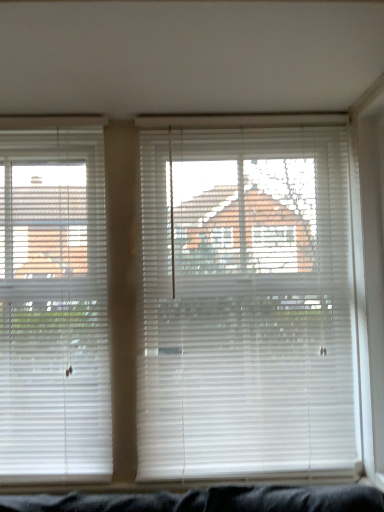
Question: From a real-world perspective, is white plastic blinds at left, positioned as the 1th window blind in left-to-right order, over white plastic blinds at center, the 2th window blind when ordered from left to right?

Choices:
 (A) no
 (B) yes

Answer: (B)

Question: Can you confirm if white plastic blinds at left, marked as the 2th window blind in a right-to-left arrangement, is thinner than white plastic blinds at center, the 2th window blind when ordered from left to right?

Choices:
 (A) no
 (B) yes

Answer: (B)

Question: Is white plastic blinds at left, positioned as the 1th window blind in left-to-right order, completely or partially outside of white plastic blinds at center, the 2th window blind when ordered from left to right?

Choices:
 (A) no
 (B) yes

Answer: (B)

Question: Can you confirm if white plastic blinds at left, marked as the 2th window blind in a right-to-left arrangement, is bigger than white plastic blinds at center, the first window blind from the right?

Choices:
 (A) no
 (B) yes

Answer: (A)

Question: Is white plastic blinds at left, positioned as the 1th window blind in left-to-right order, closer to camera compared to white plastic blinds at center, the first window blind from the right?

Choices:
 (A) no
 (B) yes

Answer: (A)

Question: Can you confirm if white plastic blinds at left, positioned as the 1th window blind in left-to-right order, is positioned to the right of white plastic blinds at center, the first window blind from the right?

Choices:
 (A) yes
 (B) no

Answer: (B)

Question: Is the position of white plastic blinds at center, the 2th window blind when ordered from left to right, more distant than that of white plastic blinds at left, marked as the 2th window blind in a right-to-left arrangement?

Choices:
 (A) yes
 (B) no

Answer: (B)

Question: Is white plastic blinds at center, the 2th window blind when ordered from left to right, oriented towards white plastic blinds at left, positioned as the 1th window blind in left-to-right order?

Choices:
 (A) no
 (B) yes

Answer: (A)

Question: Is white plastic blinds at center, the first window blind from the right, thinner than white plastic blinds at left, marked as the 2th window blind in a right-to-left arrangement?

Choices:
 (A) yes
 (B) no

Answer: (B)

Question: Is white plastic blinds at center, the first window blind from the right, oriented away from white plastic blinds at left, positioned as the 1th window blind in left-to-right order?

Choices:
 (A) yes
 (B) no

Answer: (B)

Question: Is white plastic blinds at center, the 2th window blind when ordered from left to right, placed right next to white plastic blinds at left, positioned as the 1th window blind in left-to-right order?

Choices:
 (A) no
 (B) yes

Answer: (A)

Question: Is white plastic blinds at left, marked as the 2th window blind in a right-to-left arrangement, inside white plastic blinds at center, the first window blind from the right?

Choices:
 (A) yes
 (B) no

Answer: (B)

Question: Considering the positions of white plastic blinds at center, the first window blind from the right, and white plastic blinds at left, positioned as the 1th window blind in left-to-right order, in the image, is white plastic blinds at center, the first window blind from the right, bigger or smaller than white plastic blinds at left, positioned as the 1th window blind in left-to-right order,?

Choices:
 (A) big
 (B) small

Answer: (A)